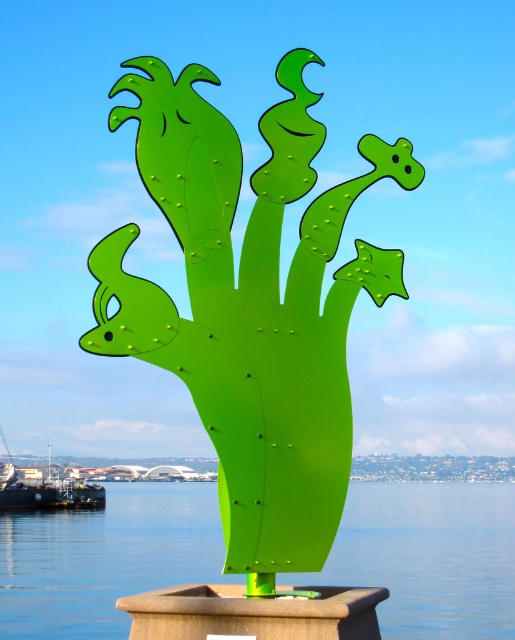
You are an art student analyzing the sculpture and the water in the image. Which object is closer to you, the green metallic sculpture at center or the green plastic water at center?

The green metallic sculpture at center is closer to you than the green plastic water at center.

You are an art curator planning to move the green metallic sculpture at center and the green plastic water at center to a new exhibition space. The new space has a 2x2 meter platform. Considering their sizes, which object should be placed first to ensure both fit properly?

The green metallic sculpture at center has a smaller size compared to green plastic water at center. Therefore, place the green plastic water at center first as it is larger, then position the smaller green metallic sculpture at center next to ensure both fit on the 2x2 meter platform.

You are standing at the point marked as point (x=250, y=307) in the image. What object is located exactly at that point?

The green metallic sculpture at center is located exactly at point (x=250, y=307).